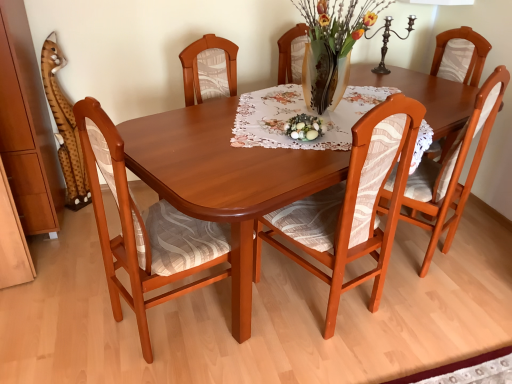
Find the location of a particular element. free space in front of matte wood chair at center, positioned as the 2th chair in left-to-right order is located at coordinates (326, 356).